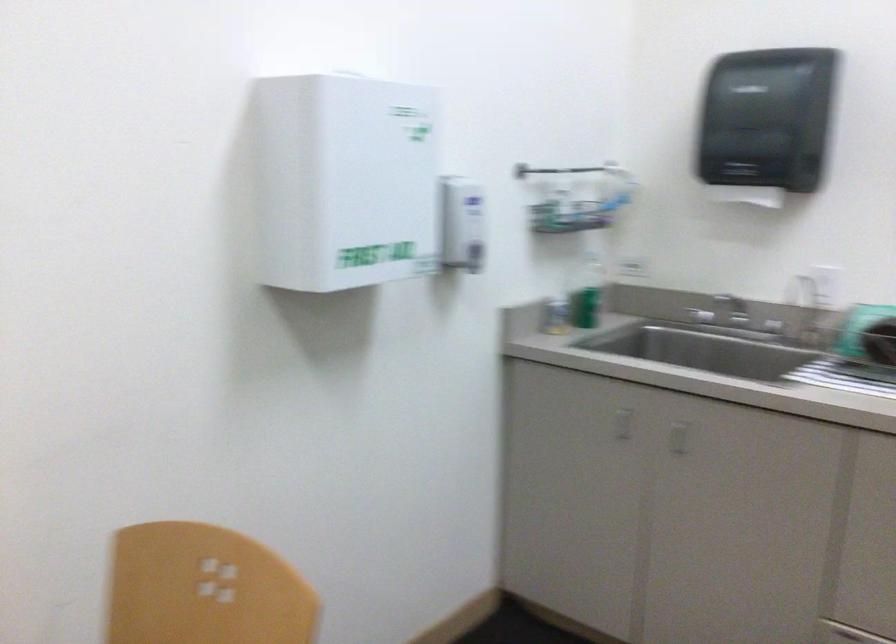
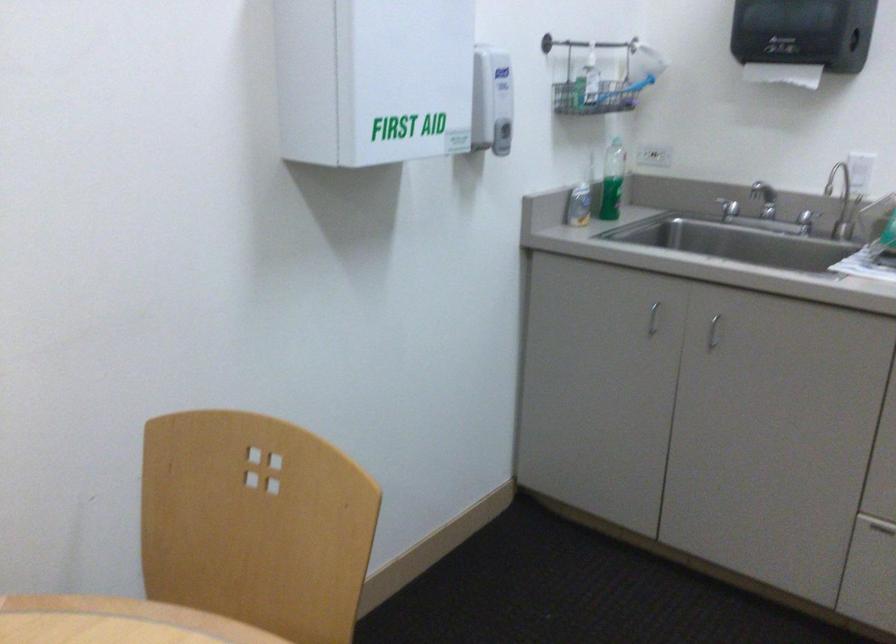
Find the pixel in the second image that matches (x=464, y=223) in the first image.

(492, 100)